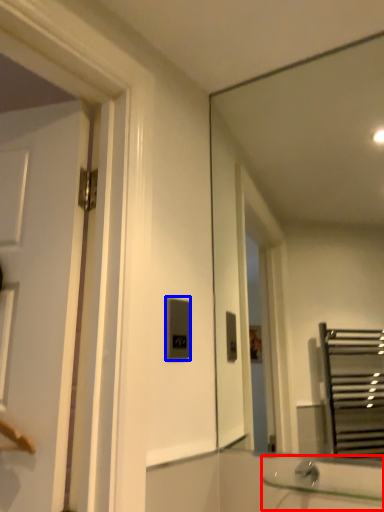
Question: Which of the following is the closest to the observer, sink (highlighted by a red box) or light switch (highlighted by a blue box)?

Choices:
 (A) sink
 (B) light switch

Answer: (A)